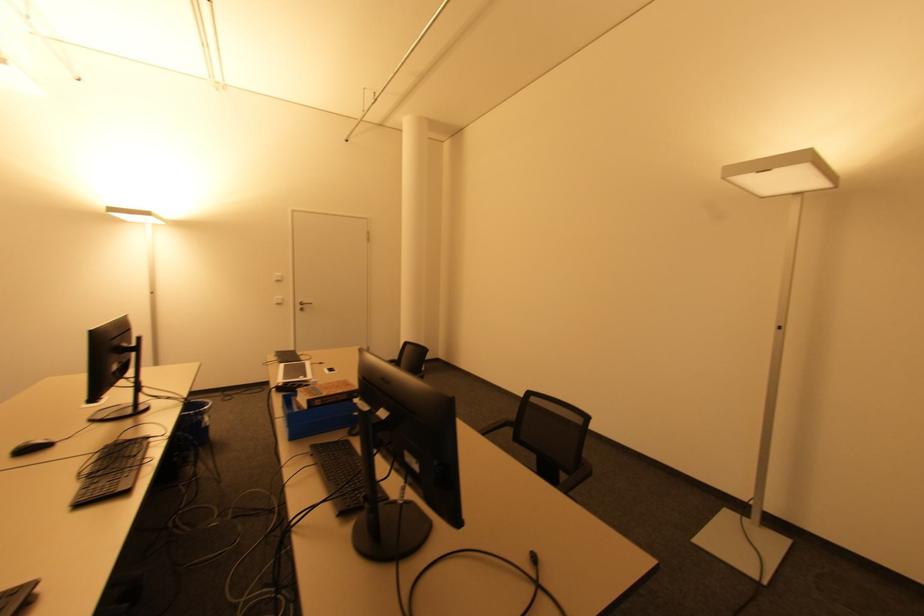
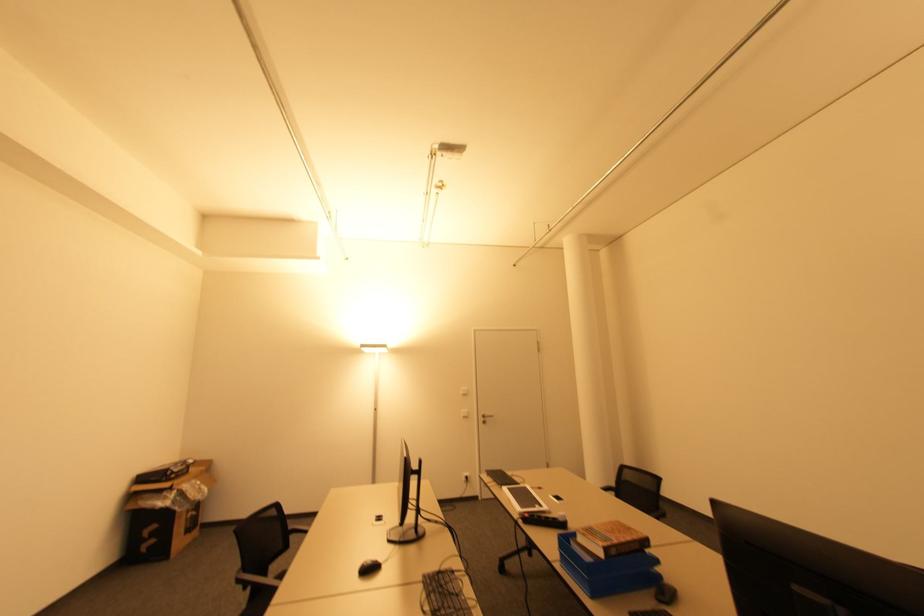
Where in the second image is the point corresponding to point (282, 280) from the first image?

(468, 392)